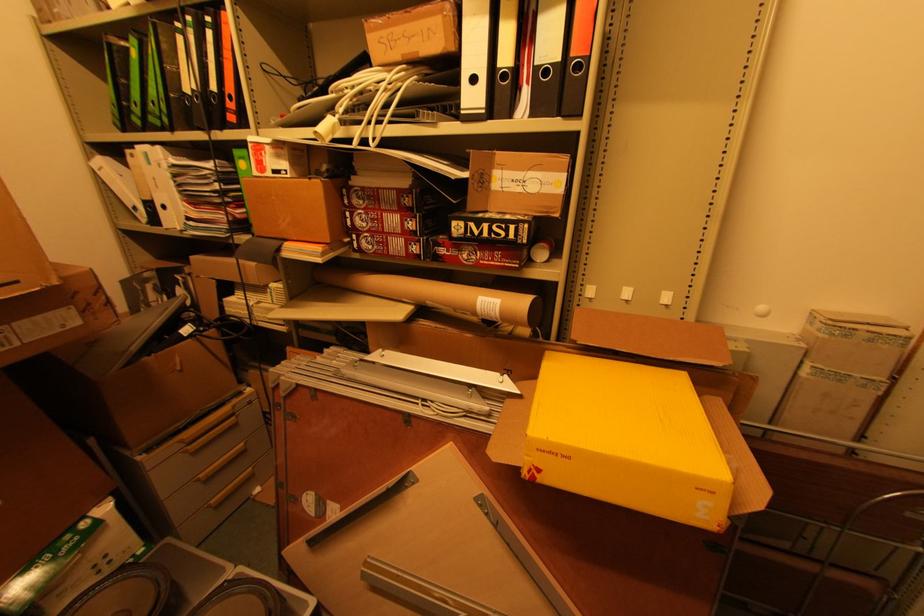
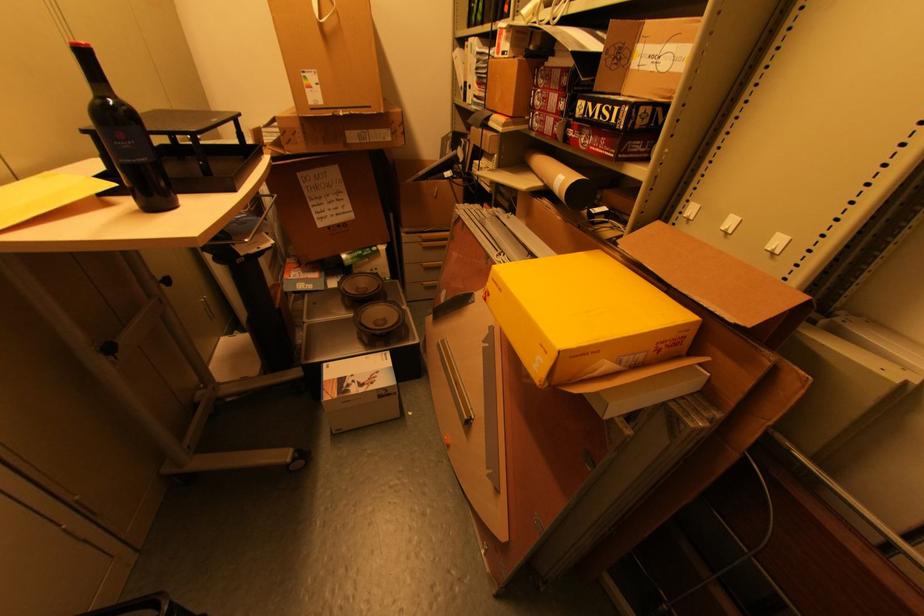
Where in the second image is the point corresponding to point (491, 262) from the first image?

(599, 148)